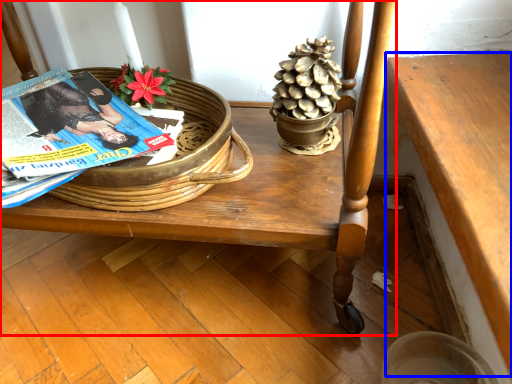
Question: Which point is further to the camera, furniture (highlighted by a red box) or table (highlighted by a blue box)?

Choices:
 (A) furniture
 (B) table

Answer: (A)